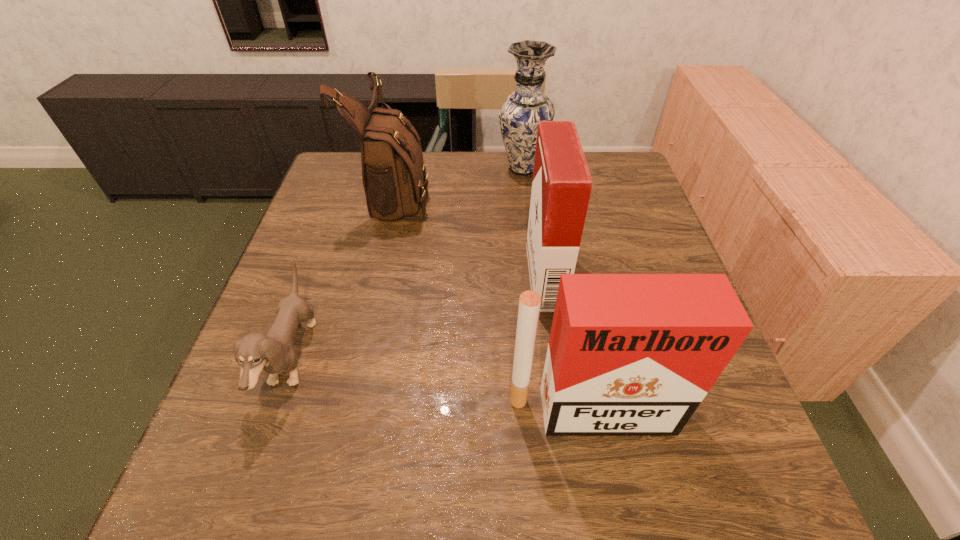
Find the location of a particular element. This screenshot has width=960, height=540. free space at the right edge of the desktop is located at coordinates (747, 448).

Locate an element on the screen. vacant area at the far left corner is located at coordinates (319, 186).

In the image, there is a desktop. Where is `vacant space at the far right corner`? The width and height of the screenshot is (960, 540). vacant space at the far right corner is located at coordinates (600, 195).

Where is `free space at the near right corner of the desktop`? This screenshot has width=960, height=540. free space at the near right corner of the desktop is located at coordinates (713, 466).

Locate an element on the screen. vacant space that's between the shortest object and the shoulder bag is located at coordinates (344, 276).

Identify the location of empty space between the puppy and the vase. (407, 264).

Locate an element on the screen. This screenshot has height=540, width=960. empty location between the puppy and the farther cigarette case is located at coordinates pos(419,318).

Locate an element on the screen. vacant area between the shoulder bag and the nearer cigarette case is located at coordinates (493, 302).

Where is `empty location between the vase and the shoulder bag`? This screenshot has height=540, width=960. empty location between the vase and the shoulder bag is located at coordinates (460, 181).

The width and height of the screenshot is (960, 540). What are the coordinates of `vacant space that's between the vase and the shoulder bag` in the screenshot? It's located at (460, 181).